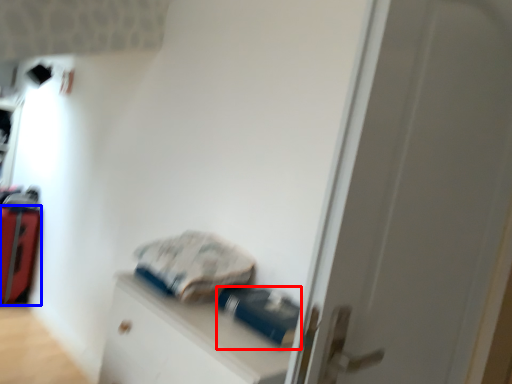
Question: Among these objects, which one is farthest to the camera, equipment (highlighted by a red box) or luggage (highlighted by a blue box)?

Choices:
 (A) equipment
 (B) luggage

Answer: (B)